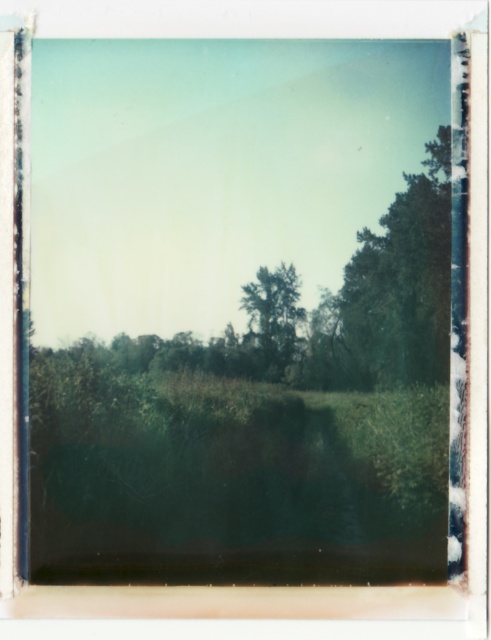
You are a bird looking for a higher perch. Which tree would be a better choice between the green leafy tree at upper right and the green leafy tree at center?

The green leafy tree at upper right is much taller than the green leafy tree at center, so it would be a better choice for a higher perch.

You are standing in the middle of the scene facing the green leafy tree at center. Which direction should you turn to see the green leafy tree at upper right?

You should turn to your right because the green leafy tree at upper right is located to the right of the green leafy tree at center.